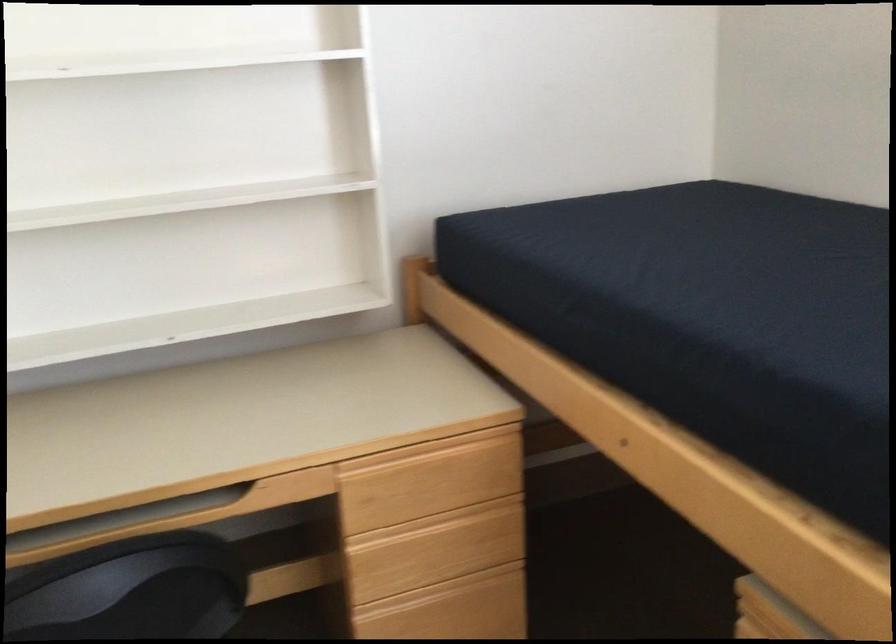
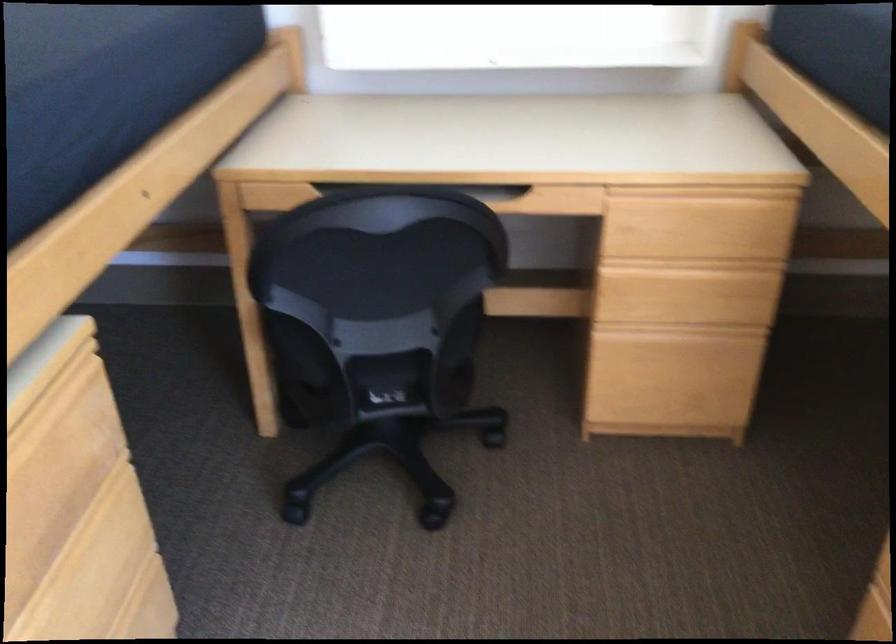
In a continuous first-person perspective shot, in which direction is the camera moving?

The cameraman walked toward right, backward.